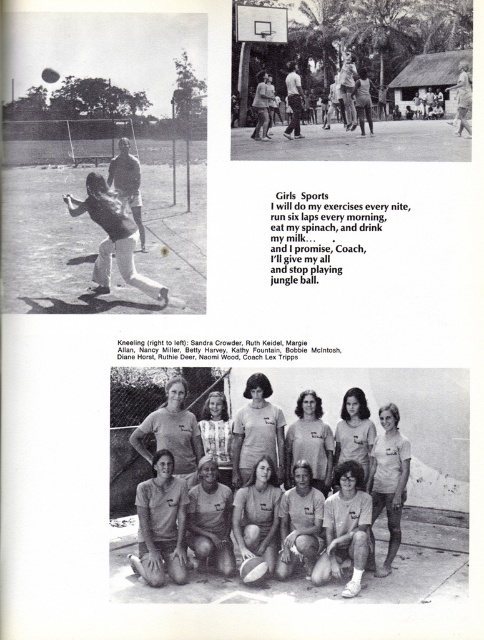
Looking at this image, between matte white jersey at center and light brown leather jacket at left, which one is positioned lower?

matte white jersey at center is below.

Does matte white jersey at center have a greater width compared to light brown leather jacket at left?

Incorrect, matte white jersey at center's width does not surpass light brown leather jacket at left's.

Find the location of a particular element. This screenshot has width=484, height=640. matte white jersey at center is located at coordinates (257, 515).

Is point (129, 252) positioned after point (268, 432)?

No, (129, 252) is in front of (268, 432).

How far apart are matte black baseball bat at left and white t-shirt at center?

The distance of matte black baseball bat at left from white t-shirt at center is 4.18 meters.

Between point (65, 198) and point (257, 404), which one is positioned in front?

Positioned in front is point (257, 404).

Find the location of a particular element. matte black baseball bat at left is located at coordinates (112, 237).

Can you confirm if light blue t-shirt at center is smaller than matte white jersey at center?

Actually, light blue t-shirt at center might be larger than matte white jersey at center.

Does light blue t-shirt at center have a lesser width compared to matte white jersey at center?

No.

Locate an element on the screen. light blue t-shirt at center is located at coordinates (389, 477).